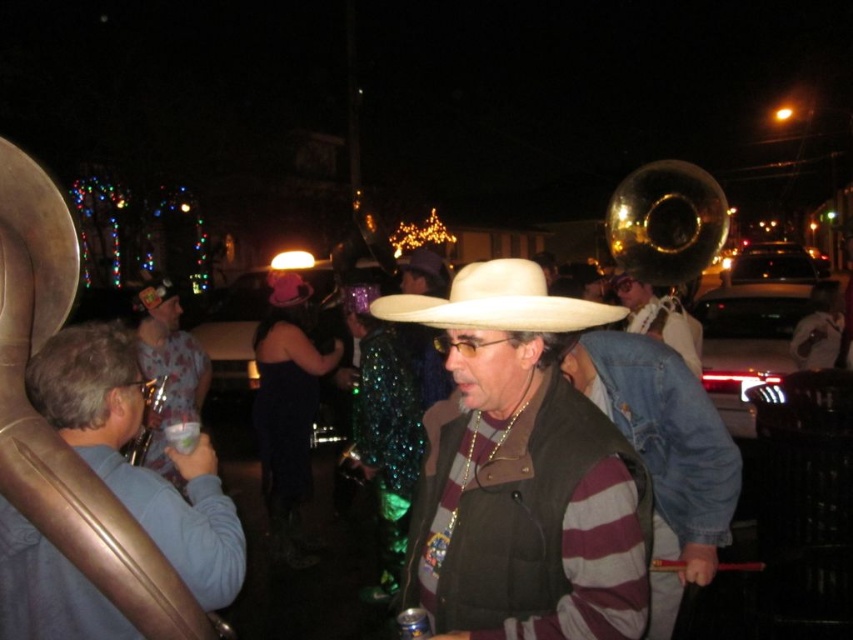
Question: Can you confirm if matte brown vest at center is positioned above shiny silver tuba at center?

Choices:
 (A) no
 (B) yes

Answer: (A)

Question: Among these points, which one is nearest to the camera?

Choices:
 (A) tap(572, 308)
 (B) tap(583, 305)
 (C) tap(677, 433)

Answer: (B)

Question: Which of the following is the farthest from the observer?

Choices:
 (A) matte brown vest at center
 (B) striped sweater at center
 (C) matte white cowboy hat at center
 (D) brushed metal saxophone at left

Answer: (C)

Question: Which point is farther from the camera taking this photo?

Choices:
 (A) (697, 349)
 (B) (636, 308)
 (C) (297, 296)
 (D) (160, 364)

Answer: (A)

Question: Does shiny silver tuba at center have a greater width compared to matte white cowboy hat at center?

Choices:
 (A) yes
 (B) no

Answer: (A)

Question: Can you confirm if striped sweater at center is positioned above matte white cowboy hat at center?

Choices:
 (A) yes
 (B) no

Answer: (B)